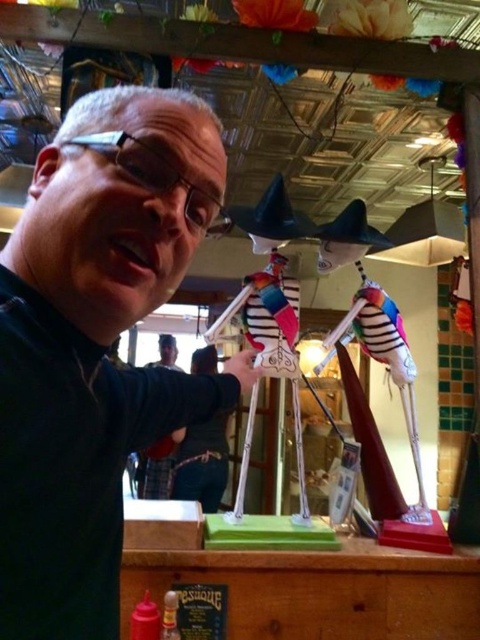
Where is the black matte man at center located in the image?

The black matte man at center is located at point 0.539 on the x axis and 0.200 on the y axis.

Based on the photo, you are a customer in a store and see the black matte man at center and the dark blue uniform at center. Which one is closer to you?

The black matte man at center is closer to you because he is in front of the dark blue uniform at center.